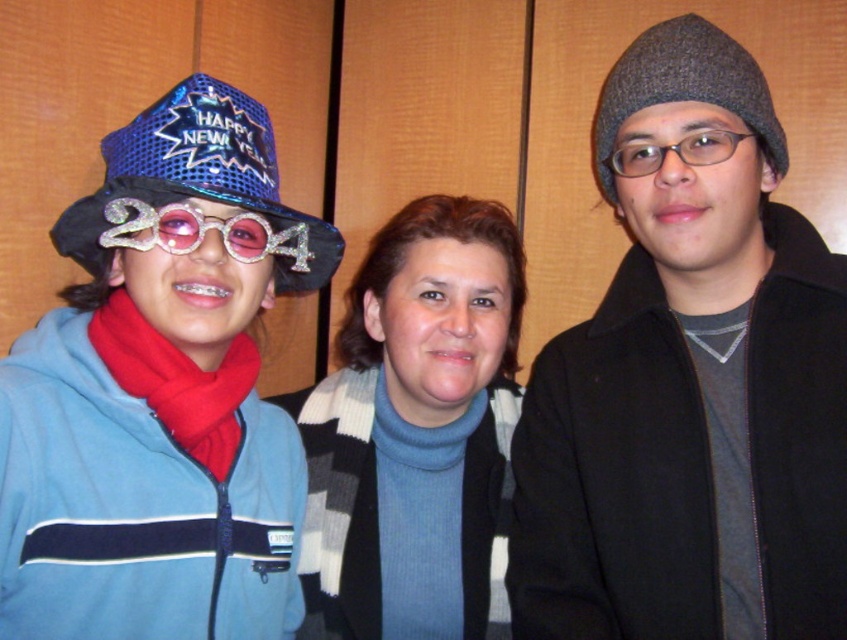
Is the position of shiny sequined hat at left more distant than that of blue knit sweater at center?

No, shiny sequined hat at left is closer to the viewer.

Can you confirm if shiny sequined hat at left is positioned to the left of blue knit sweater at center?

Yes, shiny sequined hat at left is to the left of blue knit sweater at center.

Which is in front, point (158, 150) or point (500, 246)?

Point (158, 150)

You are a GUI agent. You are given a task and a screenshot of the screen. Output one action in this format:
    pyautogui.click(x=<x>, y=<y>)
    Task: Click on the shiny sequined hat at left
    
    Given the screenshot: What is the action you would take?
    pyautogui.click(x=161, y=394)

Is point (789, 424) behind point (330, 515)?

No.

Who is positioned more to the left, knit woolen beanie at right or blue knit sweater at center?

blue knit sweater at center is more to the left.

Where is `knit woolen beanie at right`? This screenshot has width=847, height=640. knit woolen beanie at right is located at coordinates (689, 385).

This screenshot has width=847, height=640. Find the location of `knit woolen beanie at right`. knit woolen beanie at right is located at coordinates (689, 385).

Measure the distance between shiny sequined hat at left and camera.

A distance of 27.29 inches exists between shiny sequined hat at left and camera.

Between shiny sequined hat at left and sparkly blue hat at left, which one has less height?

sparkly blue hat at left is shorter.

I want to click on shiny sequined hat at left, so click(x=161, y=394).